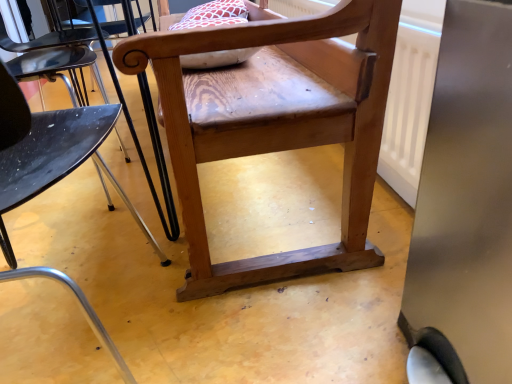
I want to click on vacant space underneath wooden chair at center, arranged as the 1th chair when viewed from the front (from a real-world perspective), so click(71, 325).